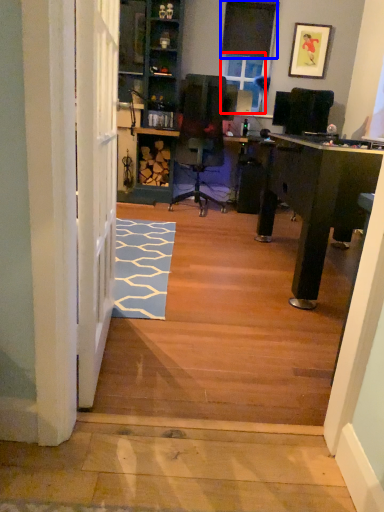
Question: Which object appears closest to the camera in this image, window screen (highlighted by a red box) or window screen (highlighted by a blue box)?

Choices:
 (A) window screen
 (B) window screen

Answer: (B)